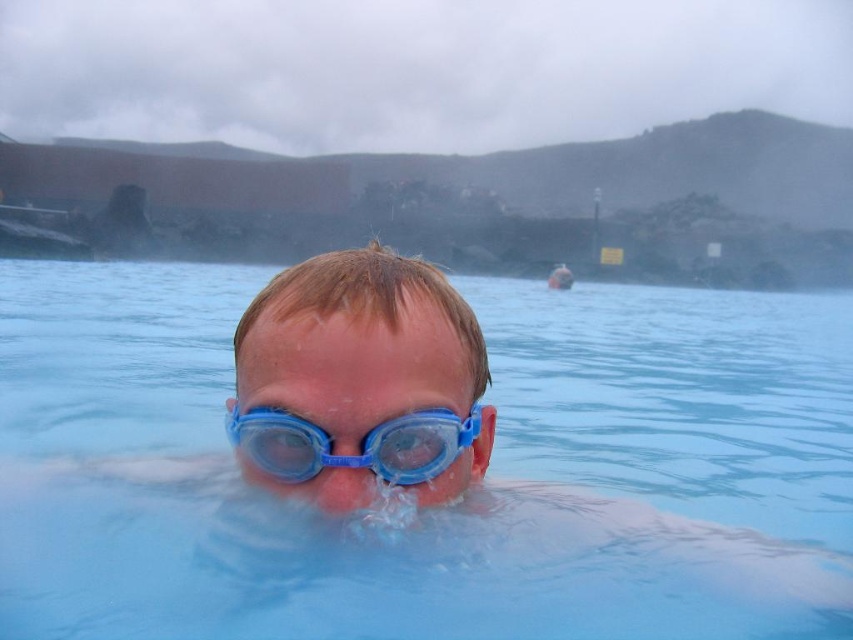
You are a photographer trying to capture the reflection of the blue translucent goggles at center in the transparent blue water at center. Based on the scene, can the goggles be fully reflected in the water?

The transparent blue water at center has a larger width than the blue translucent goggles at center, so yes, the goggles can be fully reflected in the water since the water is wider than the goggles.

You are a lifeguard on duty at this geothermal pool. You notice the transparent blue water at center and the blue translucent goggles at center. Which object is positioned higher in the image?

The transparent blue water at center is located above the blue translucent goggles at center, so it is positioned higher in the image.